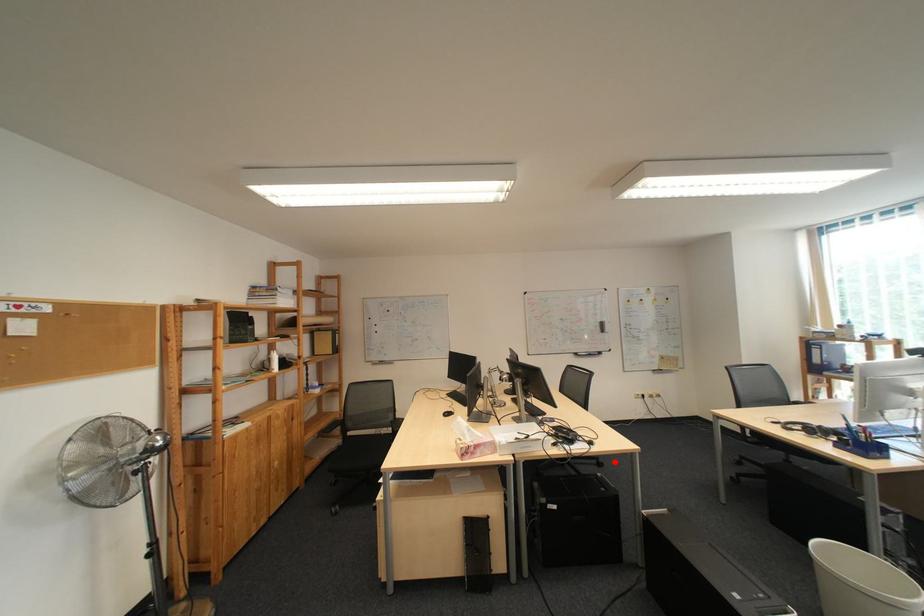
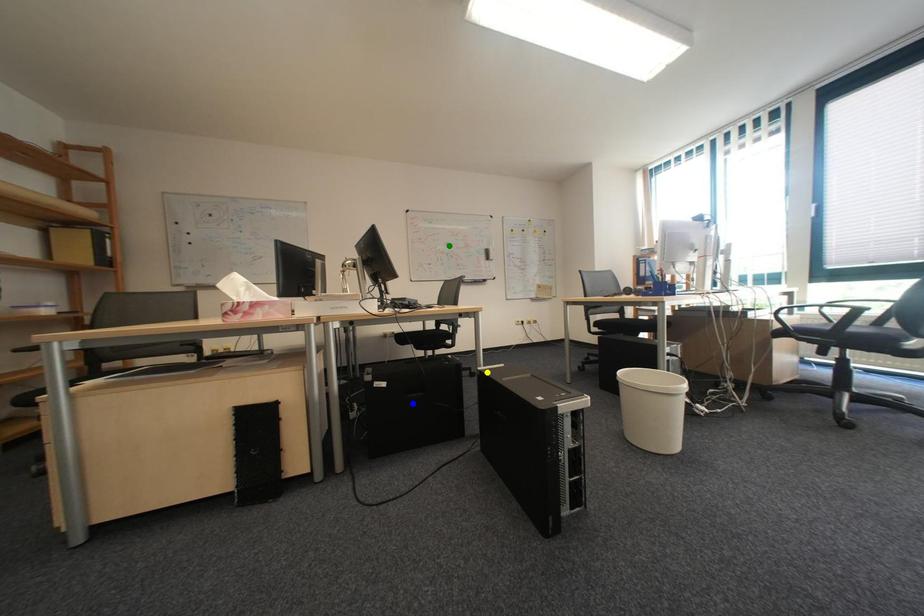
Question: I am providing you with two images of the same scene from different viewpoints. A red point is marked on the first image. You are given multiple points on the second image. In image 2, which mark is for the same physical point as the one in image 1?

Choices:
 (A) blue point
 (B) yellow point
 (C) green point

Answer: (B)